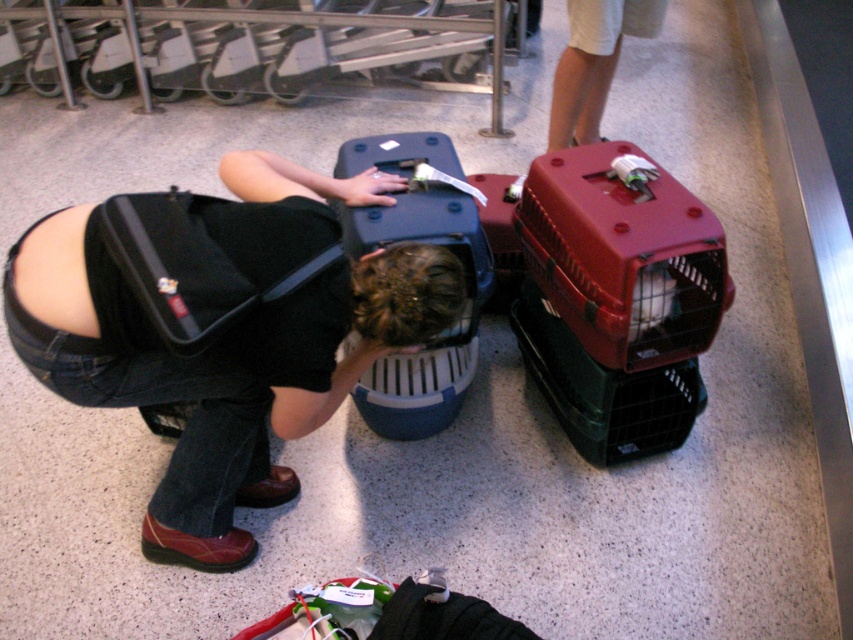
You are a traveler who needs to place your white cotton shorts at upper center into the translucent plastic pet carrier at center. Based on the scene description, will the carrier be wide enough to fit the shorts?

The translucent plastic pet carrier at center has a width larger than the white cotton shorts at upper center, so the carrier should be wide enough to fit the shorts.

You are a traveler who just arrived at the airport baggage claim area. You see a black matte suitcase at center and white cotton shorts at upper center. Which object is larger in size?

The black matte suitcase at center is bigger than the white cotton shorts at upper center according to the description.

You are a traveler at the airport baggage claim area. You see the translucent plastic pet carrier at center and the white cotton shorts at upper center. Which object is closer to you?

The translucent plastic pet carrier at center is closer to you because it is in front of the white cotton shorts at upper center.